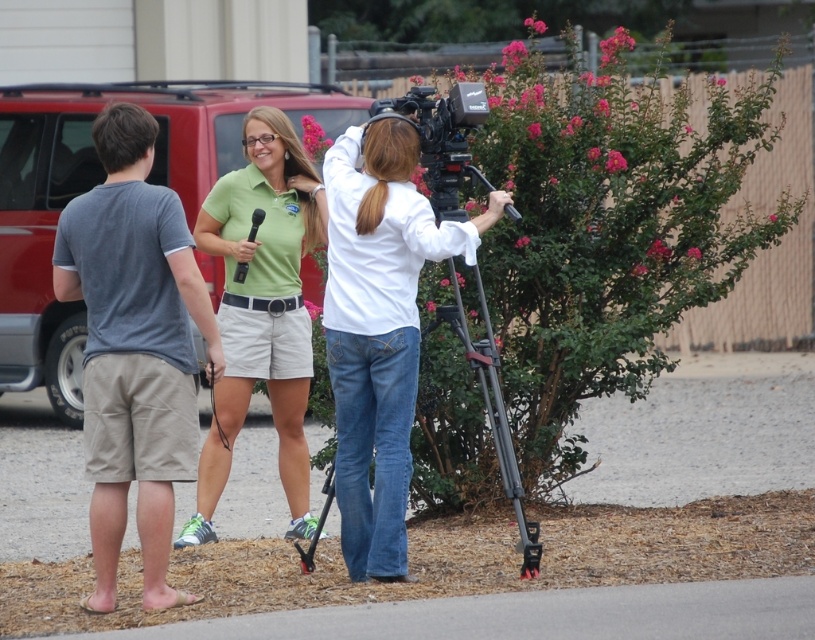
Question: Which point is farther from the camera taking this photo?

Choices:
 (A) (384, 554)
 (B) (97, 282)

Answer: (B)

Question: Is gray cotton shorts at left positioned at the back of white cotton shirt at center?

Choices:
 (A) yes
 (B) no

Answer: (B)

Question: Which object is farther from the camera taking this photo?

Choices:
 (A) gray cotton shorts at left
 (B) white cotton shirt at center
 (C) green matte shorts at center

Answer: (C)

Question: Which object is closer to the camera taking this photo?

Choices:
 (A) white cotton shirt at center
 (B) green matte shorts at center

Answer: (A)

Question: From the image, what is the correct spatial relationship of gray cotton shorts at left in relation to white cotton shirt at center?

Choices:
 (A) below
 (B) above

Answer: (A)

Question: Is gray cotton shorts at left thinner than white cotton shirt at center?

Choices:
 (A) yes
 (B) no

Answer: (A)